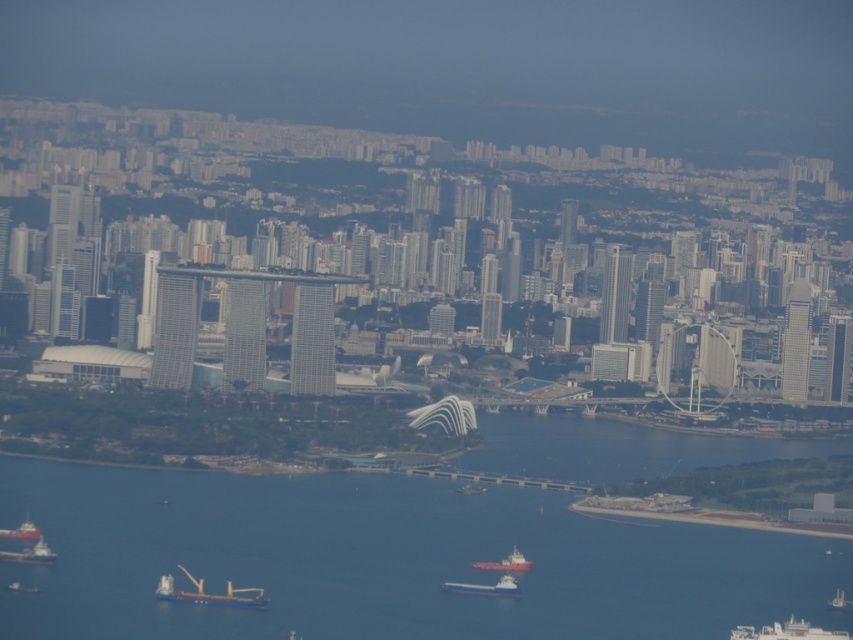
Who is more forward, (x=752, y=634) or (x=33, y=529)?

Point (x=33, y=529)

Measure the distance between white matte boat at lower right and camera.

A distance of 671.72 meters exists between white matte boat at lower right and camera.

You are a GUI agent. You are given a task and a screenshot of the screen. Output one action in this format:
    pyautogui.click(x=<x>, y=<y>)
    Task: Click on the white matte boat at lower right
    
    Given the screenshot: What is the action you would take?
    pyautogui.click(x=786, y=632)

Is point (741, 636) less distant than point (828, 604)?

Yes, it is.

Is point (737, 627) closer to camera compared to point (840, 595)?

Yes, it is.

The height and width of the screenshot is (640, 853). I want to click on white matte boat at lower right, so click(786, 632).

Does white matte boat at lower left come in front of red matte cargo ship at lower left?

Yes, it is in front of red matte cargo ship at lower left.

Does point (38, 545) lie in front of point (22, 522)?

That is False.

Who is more distant from viewer, (32,556) or (30,534)?

Positioned behind is point (30,534).

Where is `white matte boat at lower left`? This screenshot has width=853, height=640. white matte boat at lower left is located at coordinates (30, 554).